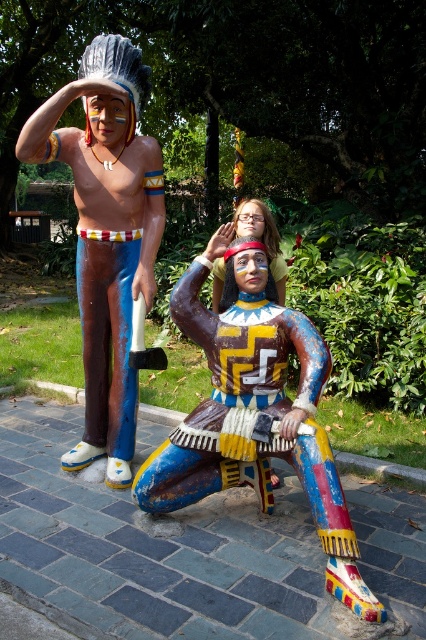
Who is more distant from viewer, (203,282) or (115,262)?

The point (115,262) is more distant.

Between painted wood figure at center and matte painted figure at left, which one appears on the right side from the viewer's perspective?

Positioned to the right is painted wood figure at center.

Which is in front, point (321, 458) or point (98, 182)?

Point (321, 458) is more forward.

Where is `painted wood figure at center`? painted wood figure at center is located at coordinates coord(255,408).